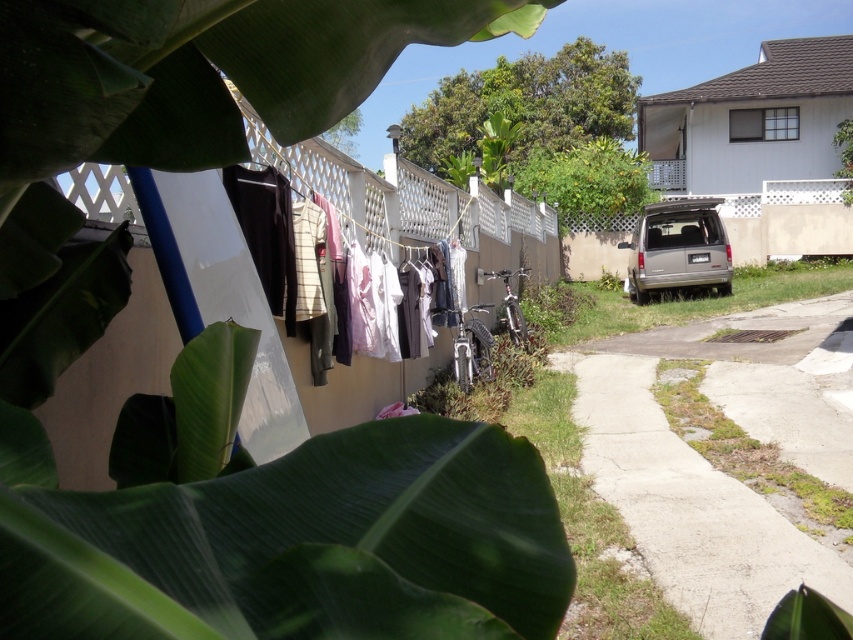
Question: Which point is closer to the camera?

Choices:
 (A) (676, 275)
 (B) (764, 294)
 (C) (816, 486)

Answer: (C)

Question: Observing the image, what is the correct spatial positioning of white cotton shirts at center in reference to green leafy plant at right?

Choices:
 (A) above
 (B) below

Answer: (B)

Question: Where is white cotton shirts at center located in relation to silver metallic van at right in the image?

Choices:
 (A) left
 (B) right

Answer: (A)

Question: Among these points, which one is farthest from the camera?

Choices:
 (A) (665, 392)
 (B) (267, 288)
 (C) (691, 316)

Answer: (C)

Question: From the image, what is the correct spatial relationship of green grass at lower right in relation to silver metallic van at right?

Choices:
 (A) left
 (B) right

Answer: (A)

Question: Based on their relative distances, which object is farther from the silver metallic van at right?

Choices:
 (A) white cotton shirts at center
 (B) green grass at lower right

Answer: (A)